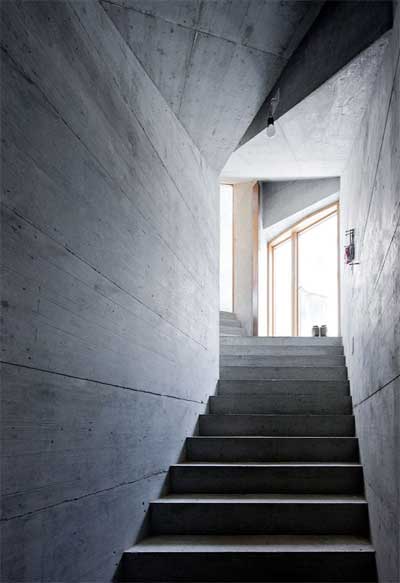
The height and width of the screenshot is (583, 400). I want to click on staircase, so click(x=275, y=382).